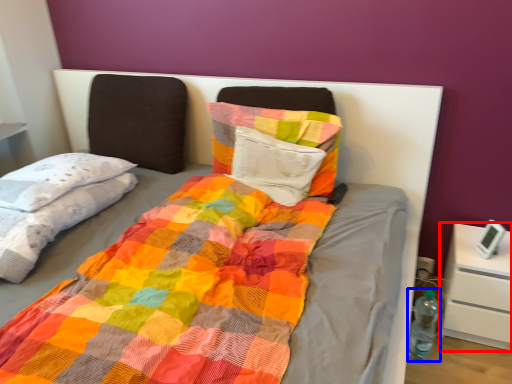
Question: Among these objects, which one is nearest to the camera, nightstand (highlighted by a red box) or bottle (highlighted by a blue box)?

Choices:
 (A) nightstand
 (B) bottle

Answer: (A)